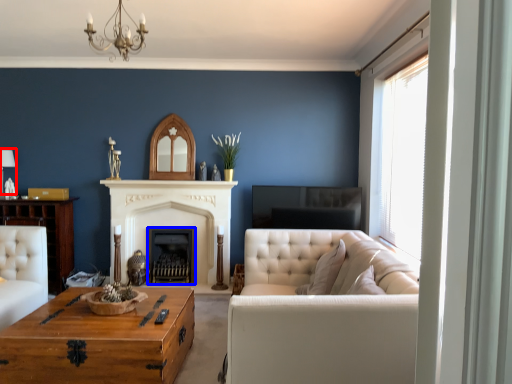
Question: Among these objects, which one is nearest to the camera, lamp (highlighted by a red box) or fireplace (highlighted by a blue box)?

Choices:
 (A) lamp
 (B) fireplace

Answer: (A)